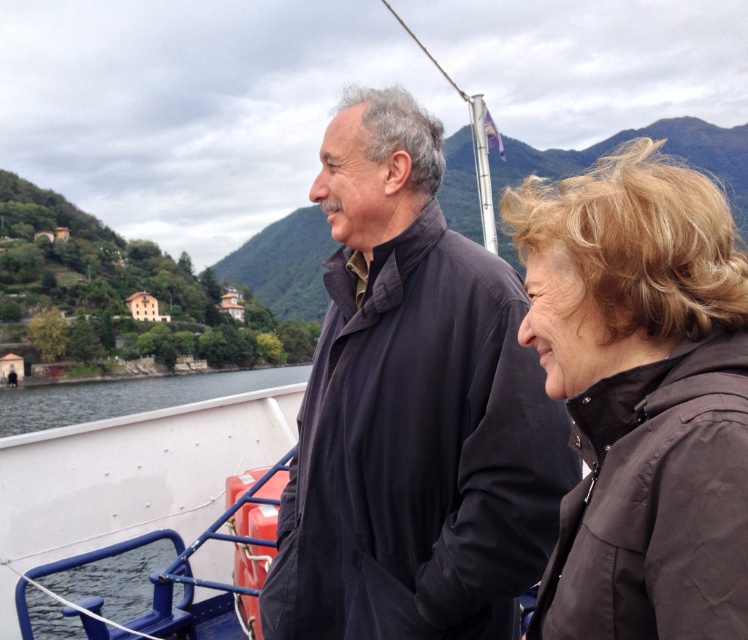
What is the exact location of the dark matte jacket at center in the image?

The dark matte jacket at center is located at point coordinates of [411,410].